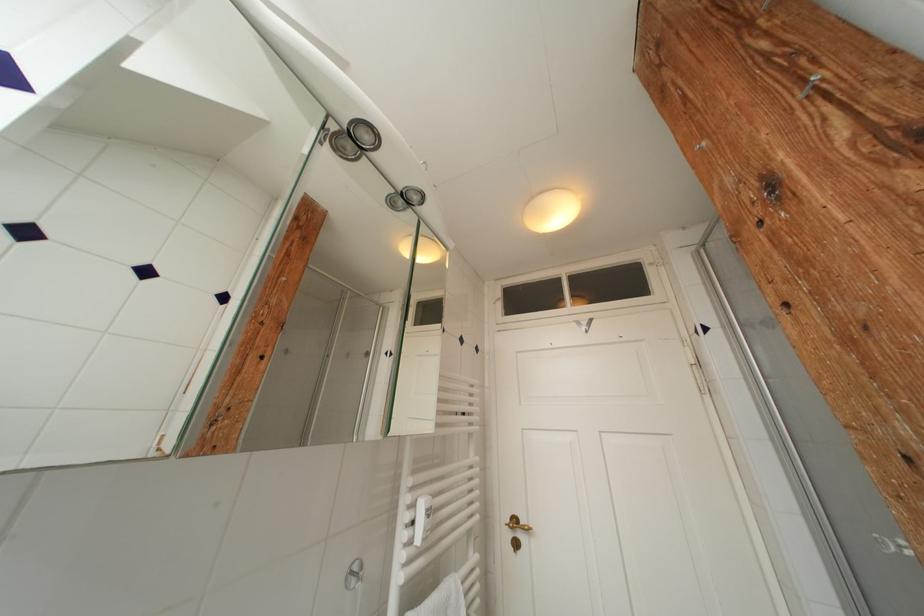
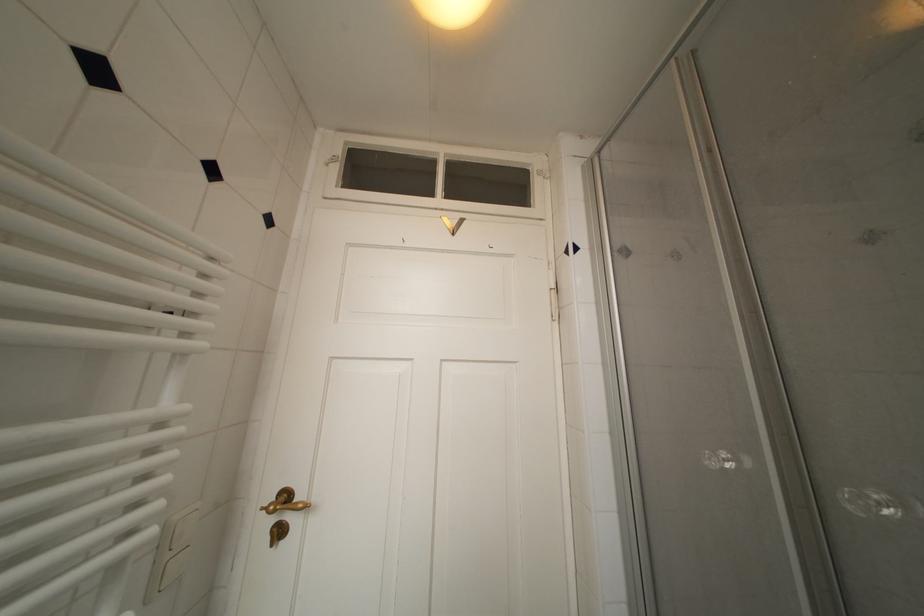
Question: Based on the continuous images, in which direction is the camera rotating? Reply with the corresponding letter.

Choices:
 (A) Left
 (B) Right
 (C) Up
 (D) Down

Answer: (B)